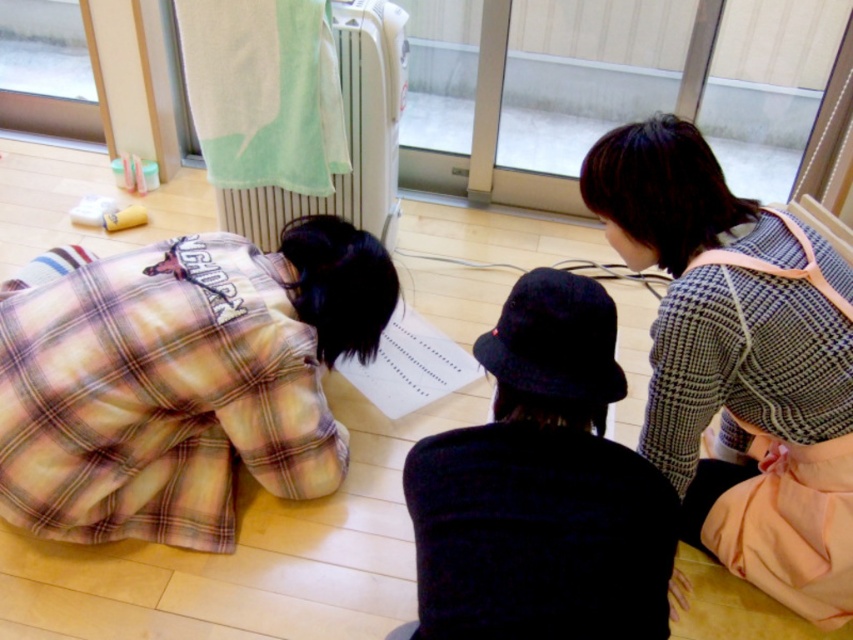
You are a guest in this room and want to know if the checkered fabric sweater at upper right is taller than the transparent glass door at upper center. Can you confirm this?

The checkered fabric sweater at upper right is much taller than the transparent glass door at upper center.

You are standing in the room and want to hang a decorative tapestry on the wall between the white plastic radiator at upper center and the transparent plastic screen door at upper left. Which object should you place the tapestry closer to if you want it to be centered between them?

To center the tapestry between the white plastic radiator at upper center and the transparent plastic screen door at upper left, you should place it equidistant from both objects. Since the white plastic radiator at upper center is to the right of the transparent plastic screen door at upper left, the center point would be halfway between their positions.